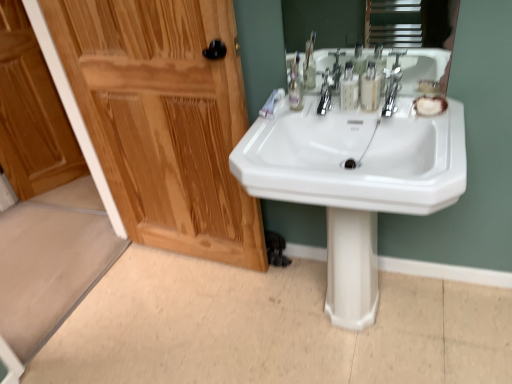
Find the location of `free space that is in between shiny wood door at left and white glossy pedestal at center`. free space that is in between shiny wood door at left and white glossy pedestal at center is located at coordinates (268, 287).